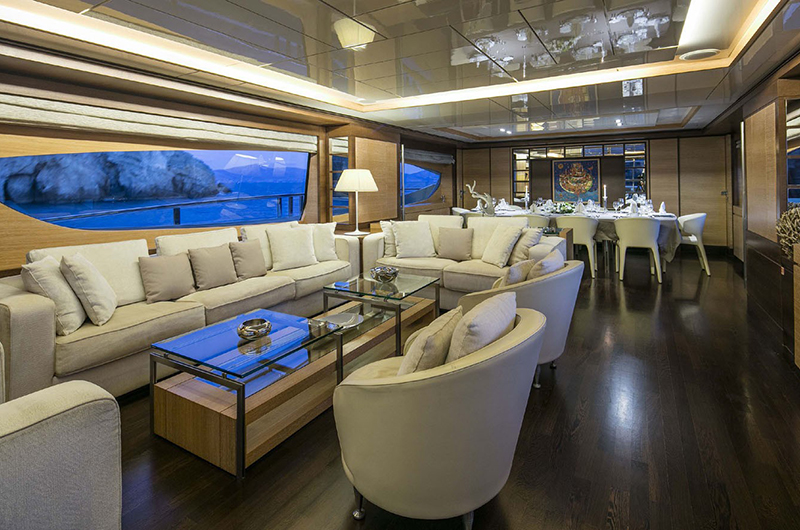
At what (x,y) coordinates should I click in order to perform the action: click on chair. Please return your answer as a coordinate pair (x, y). The image size is (800, 530). Looking at the image, I should click on tap(433, 371).